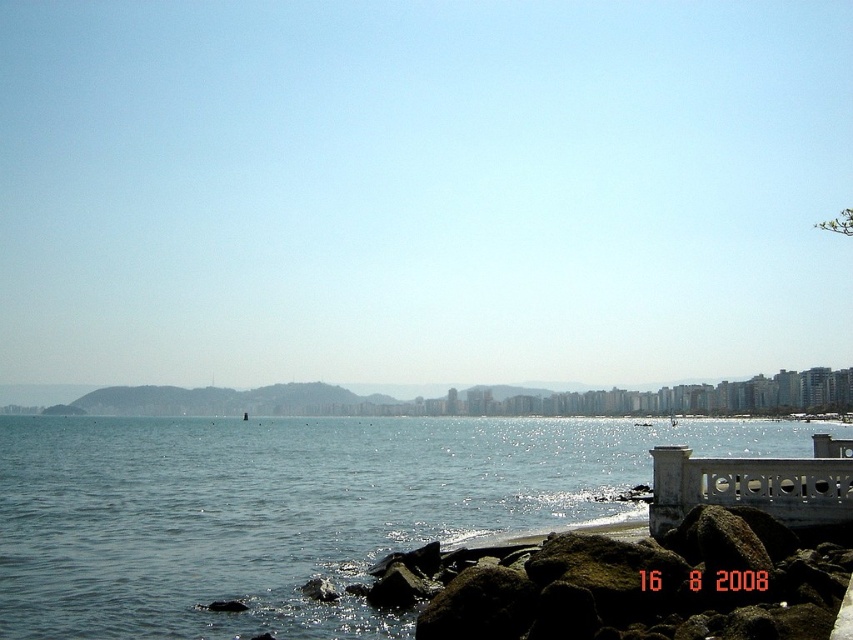
You are a photographer planning to capture the coastal scene. You have a camera with a wide angle lens that can capture large areas. Which object between the blue water at center and the brown rough rocks at lower right would be better suited for your wide angle lens?

The blue water at center is bigger than the brown rough rocks at lower right, so it would be better suited for the wide angle lens as it can capture large areas effectively.

You are standing on the walkway near the white railing on the right. You want to take a photo of the blue water at center and brown rough rocks at lower right. Which object will appear closer to you in the photo?

The brown rough rocks at lower right will appear closer to you in the photo because they are closer to the viewer than the blue water at center, which is further away.

You are standing on the walkway near the white railing on the right side of the image. You want to reach the blue water at center without stepping on the brown rough rocks at lower right. Is there a path available that avoids the rocks?

The blue water at center is positioned under brown rough rocks at lower right, so to avoid stepping on the rocks, you can move towards the water from the left side where there are no rocks mentioned in the scene description.